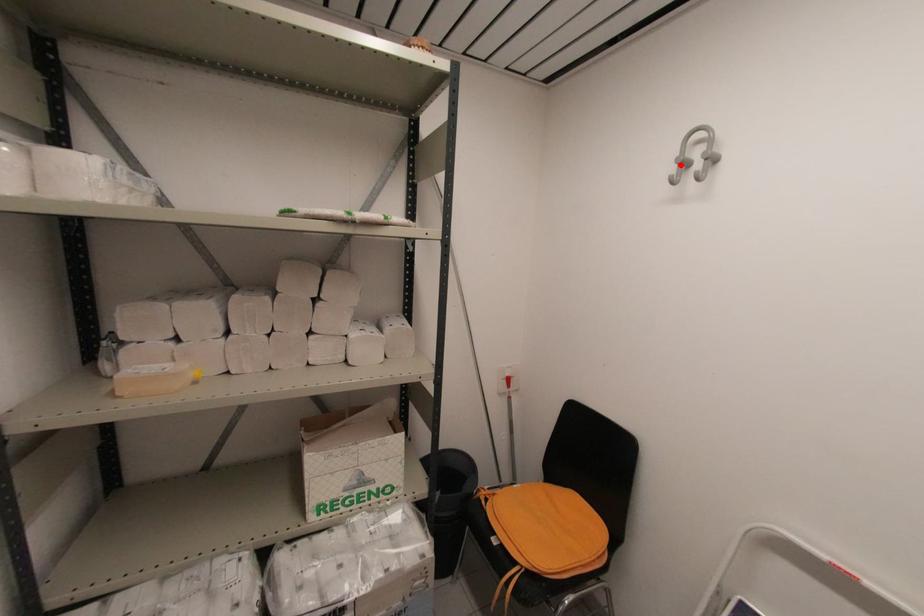
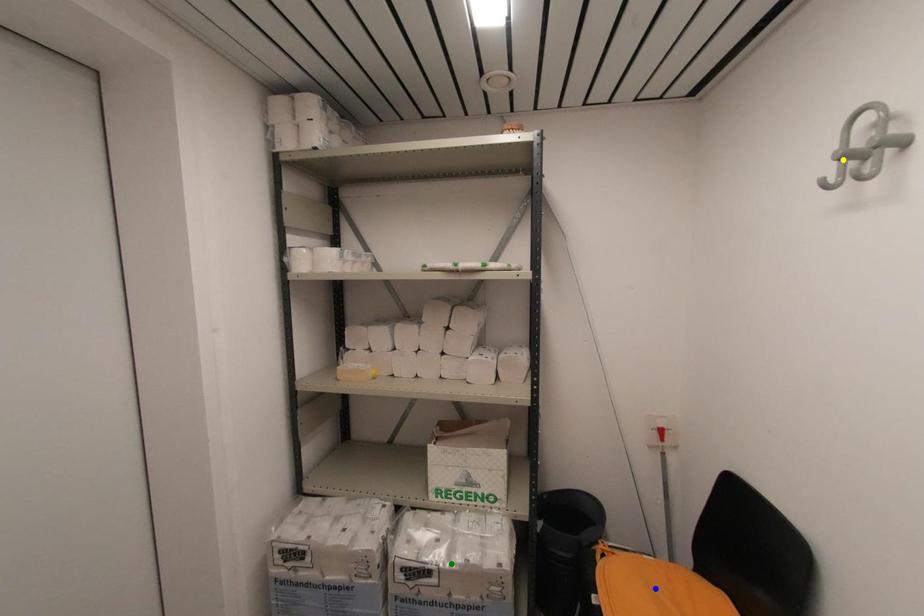
Question: I am providing you with two images of the same scene from different viewpoints. A red point is marked on the first image. You are given multiple points on the second image. Which mark in image 2 goes with the point in image 1?

Choices:
 (A) green point
 (B) blue point
 (C) yellow point

Answer: (C)